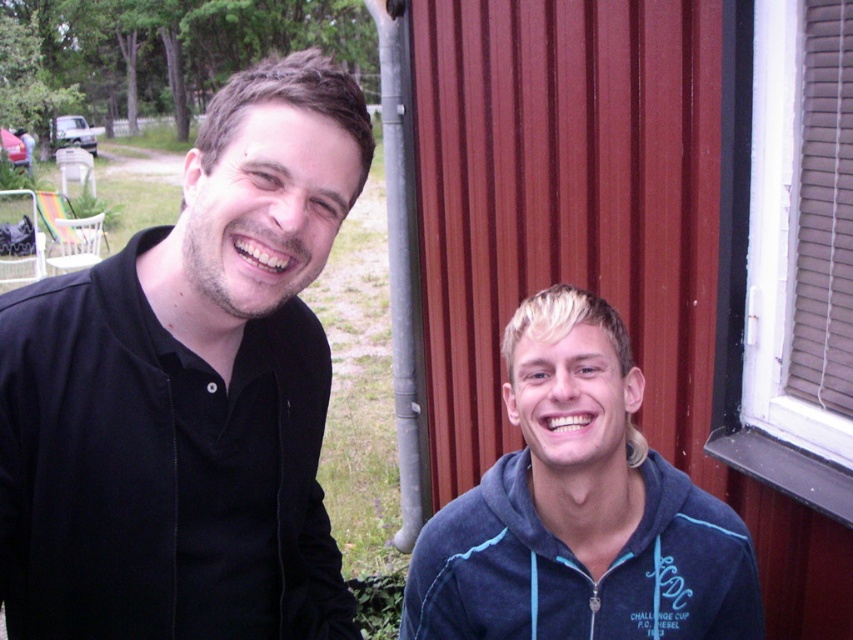
Between point (271, 84) and point (490, 566), which one is positioned behind?

Positioned behind is point (490, 566).

Does black matte shirt at left appear under blue fleece sweatshirt at lower right?

Incorrect, black matte shirt at left is not positioned below blue fleece sweatshirt at lower right.

Is point (103, 529) farther from viewer compared to point (576, 580)?

No.

Find the location of a particular element. The width and height of the screenshot is (853, 640). black matte shirt at left is located at coordinates (189, 392).